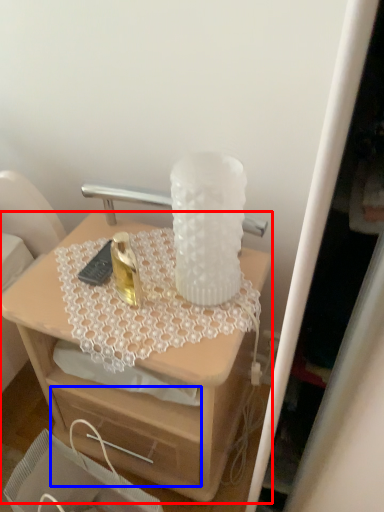
Question: Among these objects, which one is nearest to the camera, desk (highlighted by a red box) or drawer (highlighted by a blue box)?

Choices:
 (A) desk
 (B) drawer

Answer: (B)